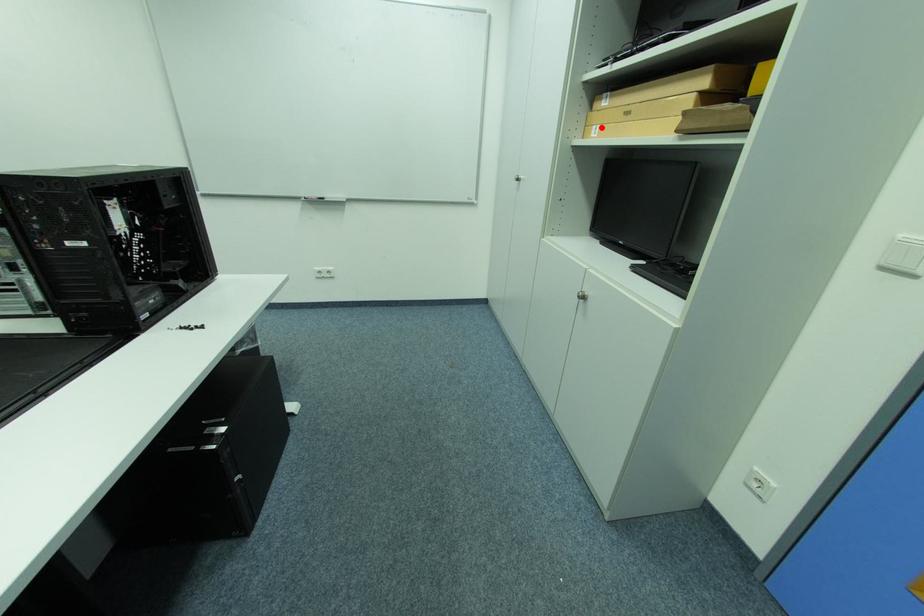
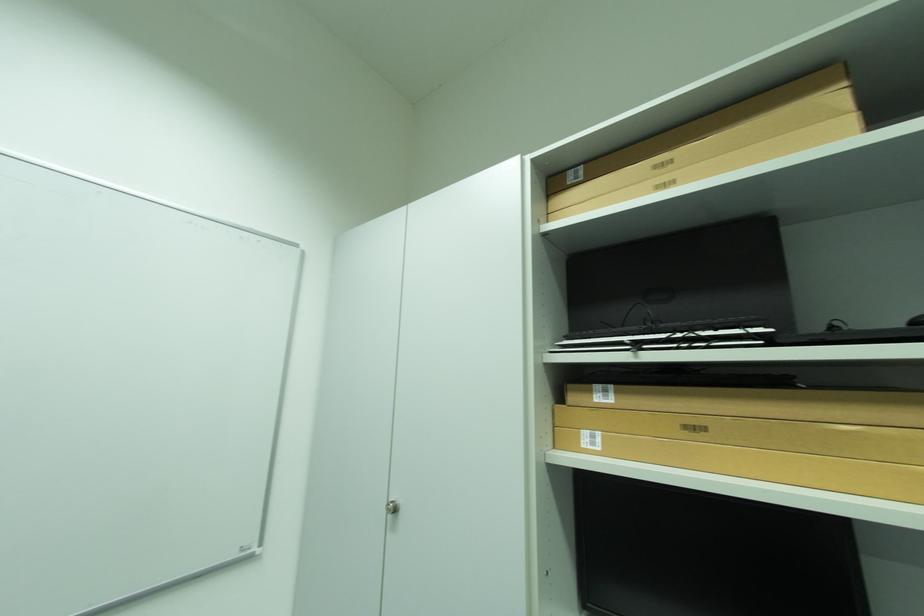
In the second image, find the point that corresponds to the highlighted location in the first image.

(593, 434)